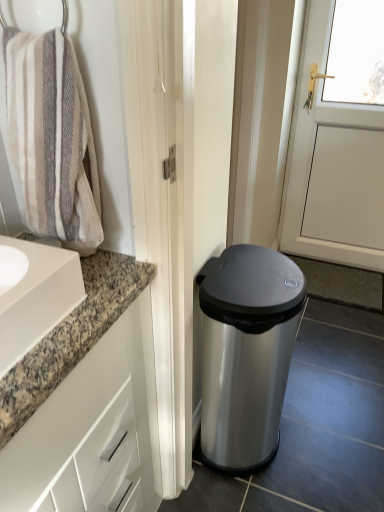
The height and width of the screenshot is (512, 384). What do you see at coordinates (52, 138) in the screenshot?
I see `beige textured towel at left` at bounding box center [52, 138].

What is the approximate width of satin silver trash can at lower right?

It is 13.52 inches.

Where is `beige textured towel at left`? Image resolution: width=384 pixels, height=512 pixels. beige textured towel at left is located at coordinates (52, 138).

Considering the sizes of beige textured towel at left and white glossy cabinet at left in the image, is beige textured towel at left bigger or smaller than white glossy cabinet at left?

beige textured towel at left is smaller than white glossy cabinet at left.

Is beige textured towel at left positioned before white glossy cabinet at left?

No, it is behind white glossy cabinet at left.

In the scene shown: Would you say beige textured towel at left is inside or outside white glossy cabinet at left?

beige textured towel at left is outside white glossy cabinet at left.

Are beige textured towel at left and white glossy cabinet at left making contact?

They are not placed beside each other.

Between point (201, 444) and point (74, 76), which one is positioned in front?

The point (74, 76) is closer to the camera.

Do you think satin silver trash can at lower right is within beige textured towel at left, or outside of it?

satin silver trash can at lower right is outside beige textured towel at left.

Is satin silver trash can at lower right directly adjacent to beige textured towel at left?

satin silver trash can at lower right and beige textured towel at left are clearly separated.

Looking at this image, is satin silver trash can at lower right bigger than beige textured towel at left?

Correct, satin silver trash can at lower right is larger in size than beige textured towel at left.

Is there a large distance between white glossy cabinet at left and beige textured towel at left?

No, white glossy cabinet at left is not far away from beige textured towel at left.

Considering the sizes of white glossy cabinet at left and beige textured towel at left in the image, is white glossy cabinet at left taller or shorter than beige textured towel at left?

Clearly, white glossy cabinet at left is taller compared to beige textured towel at left.

Can you confirm if white glossy cabinet at left is wider than beige textured towel at left?

Correct, the width of white glossy cabinet at left exceeds that of beige textured towel at left.

Between white glossy cabinet at left and beige textured towel at left, which one is positioned in front?

white glossy cabinet at left is closer to the camera.

From the image's perspective, is white glossy cabinet at left above satin silver trash can at lower right?

No, from the image's perspective, white glossy cabinet at left is not over satin silver trash can at lower right.

Considering the sizes of white glossy cabinet at left and satin silver trash can at lower right in the image, is white glossy cabinet at left taller or shorter than satin silver trash can at lower right?

In the image, white glossy cabinet at left appears to be taller than satin silver trash can at lower right.

Is white glossy cabinet at left looking in the opposite direction of satin silver trash can at lower right?

white glossy cabinet at left is not turned away from satin silver trash can at lower right.

Is point (37, 334) positioned in front of point (252, 365)?

Yes.

Between satin silver trash can at lower right and white glossy cabinet at left, which one has less height?

With less height is satin silver trash can at lower right.

Is satin silver trash can at lower right closer to camera compared to white glossy cabinet at left?

No, satin silver trash can at lower right is further to the viewer.

Does point (249, 451) lie in front of point (140, 440)?

That is False.

Between satin silver trash can at lower right and white glossy cabinet at left, which one has larger width?

white glossy cabinet at left is wider.

Measure the distance from beige textured towel at left to satin silver trash can at lower right.

beige textured towel at left and satin silver trash can at lower right are 24.37 inches apart from each other.

In the scene shown: From a real-world perspective, is beige textured towel at left located beneath satin silver trash can at lower right?

No.

Is beige textured towel at left beside satin silver trash can at lower right?

No, beige textured towel at left is not making contact with satin silver trash can at lower right.

Could satin silver trash can at lower right be considered to be inside beige textured towel at left?

No, satin silver trash can at lower right is located outside of beige textured towel at left.

This screenshot has width=384, height=512. Find the location of `bath towel behind the white glossy cabinet at left`. bath towel behind the white glossy cabinet at left is located at coordinates (52, 138).

What are the coordinates of `waste container below the beige textured towel at left (from a real-world perspective)` in the screenshot? It's located at (246, 352).

Looking at the image, which one is located further to beige textured towel at left, satin silver trash can at lower right or white glossy cabinet at left?

satin silver trash can at lower right is positioned further to the anchor beige textured towel at left.

Considering their positions, is white glossy cabinet at left positioned closer to satin silver trash can at lower right than beige textured towel at left?

white glossy cabinet at left lies closer to satin silver trash can at lower right than the other object.

Considering their positions, is beige textured towel at left positioned closer to satin silver trash can at lower right than white glossy cabinet at left?

white glossy cabinet at left.

Estimate the real-world distances between objects in this image. Which object is closer to beige textured towel at left, white glossy cabinet at left or satin silver trash can at lower right?

white glossy cabinet at left lies closer to beige textured towel at left than the other object.

When comparing their distances from white glossy cabinet at left, does satin silver trash can at lower right or beige textured towel at left seem further?

satin silver trash can at lower right lies further to white glossy cabinet at left than the other object.

Based on their spatial positions, is beige textured towel at left or satin silver trash can at lower right closer to white glossy cabinet at left?

The object closer to white glossy cabinet at left is beige textured towel at left.

This screenshot has height=512, width=384. I want to click on waste container between beige textured towel at left and white glossy cabinet at left vertically, so click(246, 352).